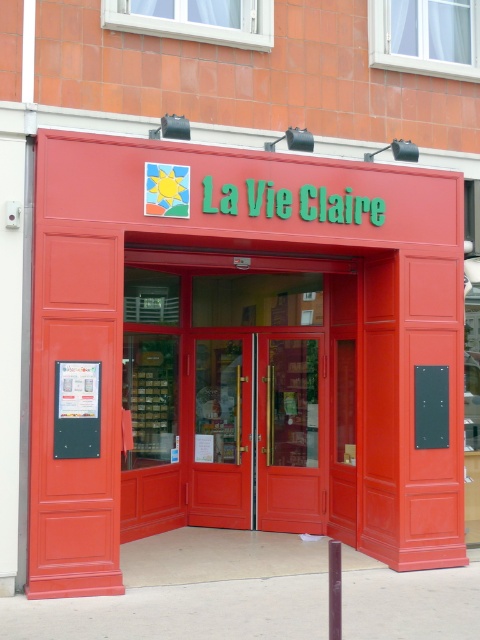
You are a delivery person trying to enter the store through the entrance. The doors are labeled as matte red doors at center and matte red door at center. Since there are two doors, you need to know which one is the left door to open first. Can you determine which door is on the left side?

The matte red doors at center and matte red door at center are actually the same door. The distance between them is 35.95 inches, which indicates they are part of a double door set. Therefore, there is no left door as they form a single entrance unit.

You are a delivery person trying to unload a large box that is 1.2 meters wide. You see the smooth glossy door at center and the red glossy door at center. Which door can the box fit through?

The smooth glossy door at center has a width surpassing the red glossy door at center, so the box can fit through the smooth glossy door at center if its width is at least 1.2 meters. However, the exact width isn not provided, so we can only conclude that the smooth glossy door is wider than the red one.

You are standing at the entrance of La Vie Claire store. The store has a black notice board on the left side. Where exactly are the matte red doors at center located in relation to the black notice board?

The matte red doors at center are positioned at point (240, 353), which is to the right of the black notice board on the left side of the entrance.